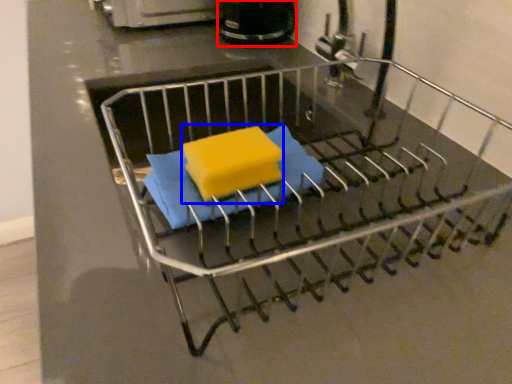
Question: Which object is further to the camera taking this photo, appliance (highlighted by a red box) or cheese (highlighted by a blue box)?

Choices:
 (A) appliance
 (B) cheese

Answer: (A)